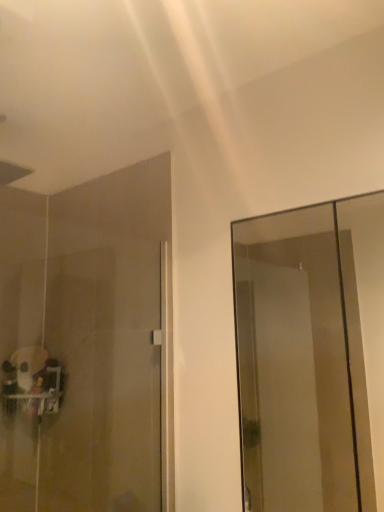
Describe the element at coordinates (87, 345) in the screenshot. The width and height of the screenshot is (384, 512). I see `frosted glass screen door at left` at that location.

Where is `frosted glass screen door at left`? frosted glass screen door at left is located at coordinates (87, 345).

Where is `frosted glass screen door at left`? The image size is (384, 512). frosted glass screen door at left is located at coordinates (87, 345).